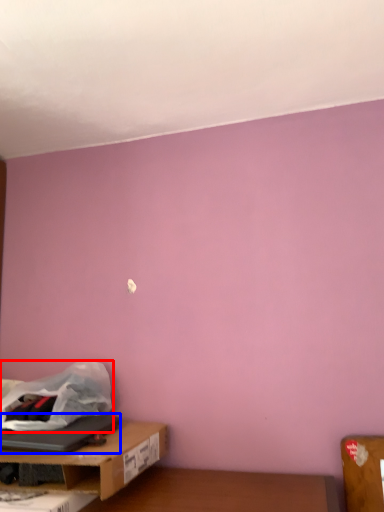
Question: Among these objects, which one is farthest to the camera, plastic bag (highlighted by a red box) or laptop (highlighted by a blue box)?

Choices:
 (A) plastic bag
 (B) laptop

Answer: (A)